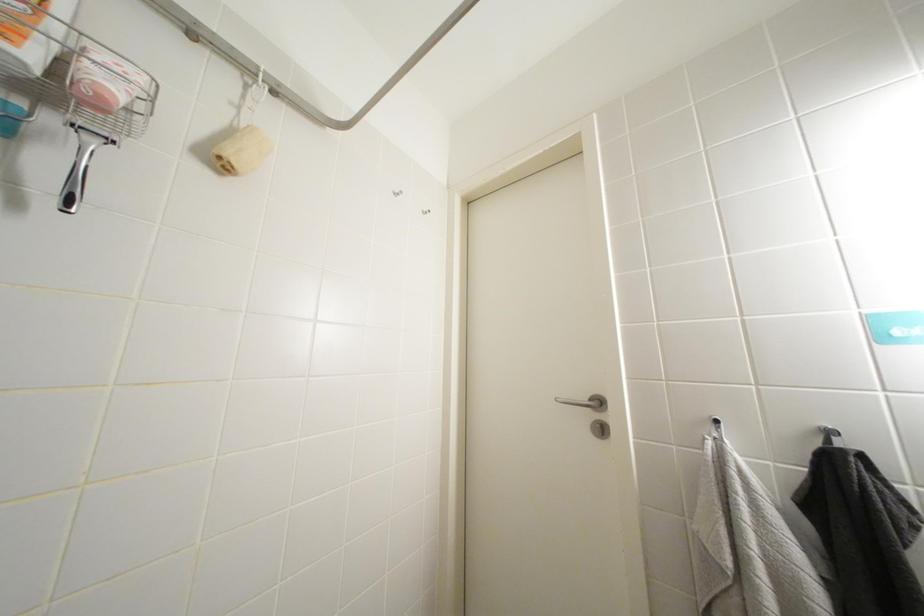
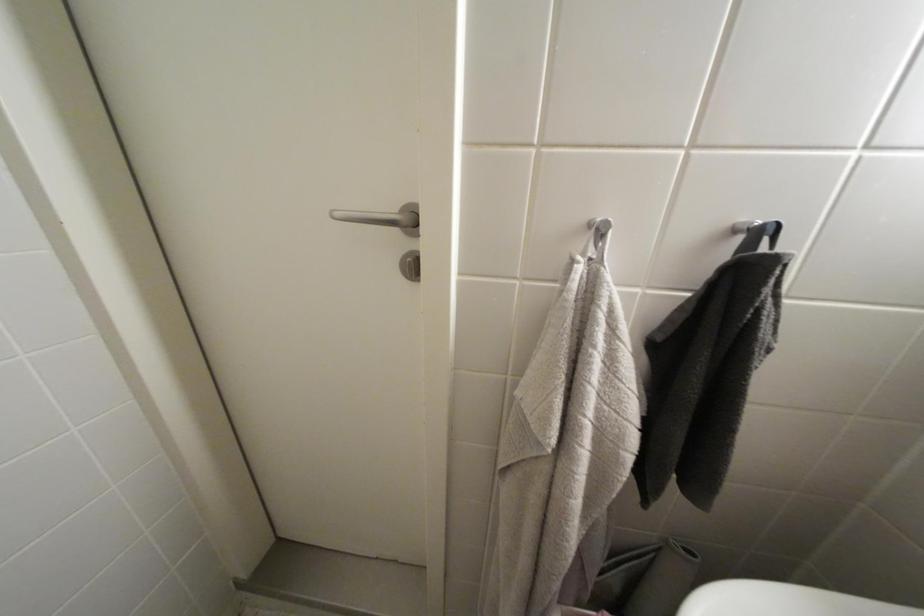
The first image is from the beginning of the video and the second image is from the end. How did the camera likely rotate when shooting the video?

The rotation direction of the camera is right-down.